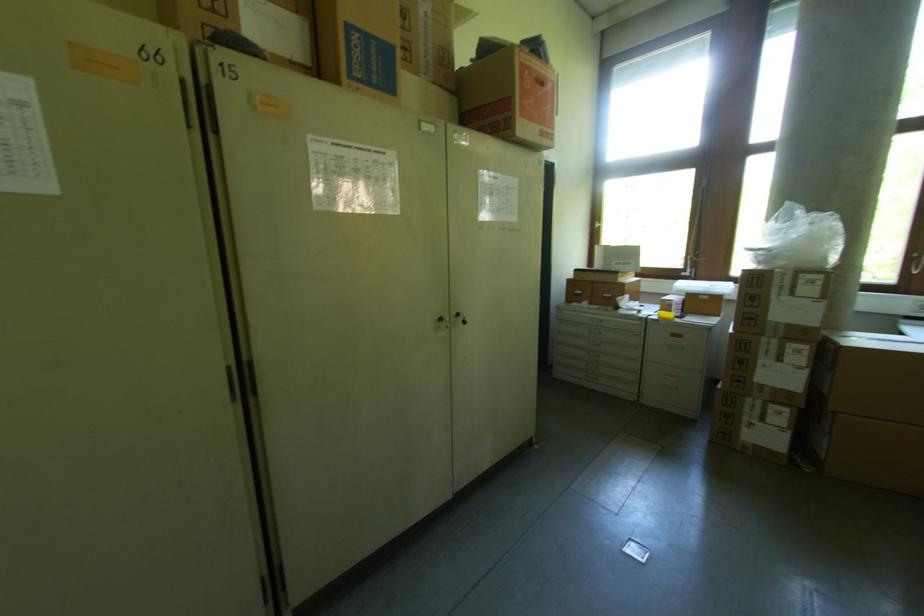
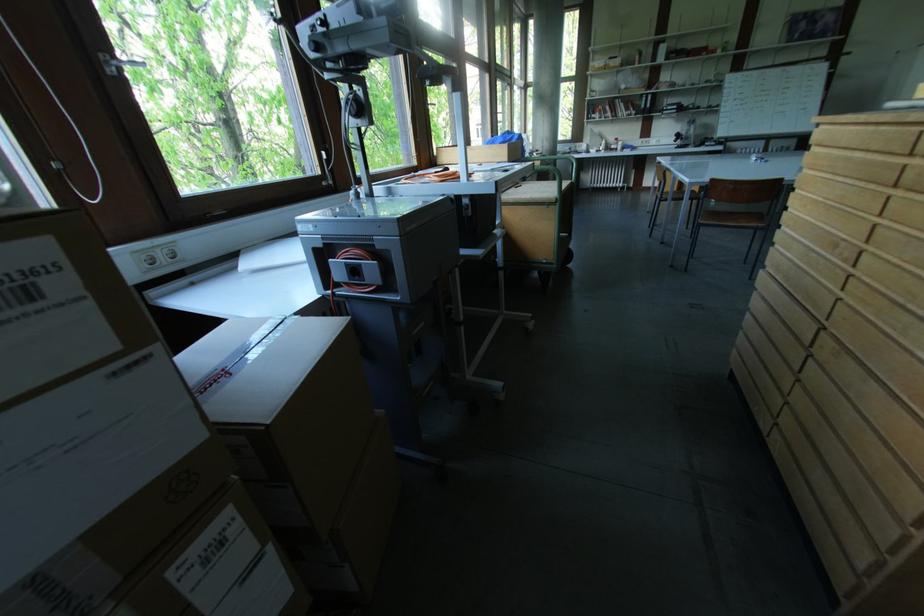
Where in the second image is the point corresponding to pixel 845 347 from the first image?

(271, 429)